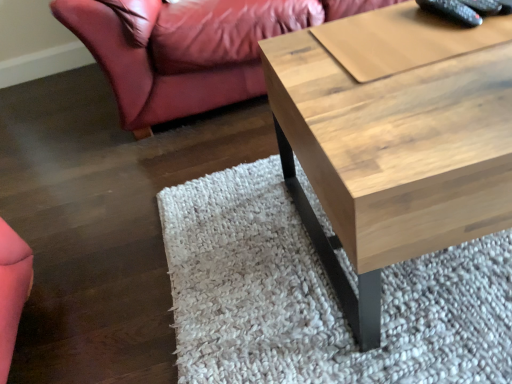
Identify the location of empty space that is ontop of natural wood coffee table at center (from a real-world perspective). The width and height of the screenshot is (512, 384). (416, 61).